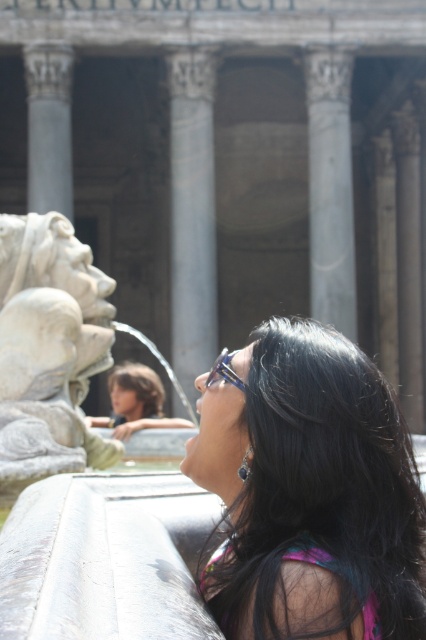
Is shiny black sunglasses at center to the right of white marble column at center from the viewer's perspective?

Correct, you'll find shiny black sunglasses at center to the right of white marble column at center.

Which is in front, point (262, 435) or point (51, 189)?

Point (262, 435) is more forward.

The width and height of the screenshot is (426, 640). In order to click on shiny black sunglasses at center in this screenshot , I will do `click(310, 492)`.

Can you confirm if gray marble pillar at center is shorter than smooth stone column at center?

In fact, gray marble pillar at center may be taller than smooth stone column at center.

Is gray marble pillar at center further to camera compared to smooth stone column at center?

That is False.

Locate an element on the screen. This screenshot has height=640, width=426. gray marble pillar at center is located at coordinates (192, 214).

This screenshot has width=426, height=640. I want to click on gray marble pillar at center, so click(x=192, y=214).

Can you confirm if white stone lion at left is positioned to the right of white marble column at center?

Yes, white stone lion at left is to the right of white marble column at center.

Is the position of white stone lion at left less distant than that of white marble column at center?

Yes, white stone lion at left is closer to the viewer.

Find the location of a particular element. Image resolution: width=426 pixels, height=640 pixels. white stone lion at left is located at coordinates (48, 349).

Where is `white stone lion at left`? This screenshot has height=640, width=426. white stone lion at left is located at coordinates (48, 349).